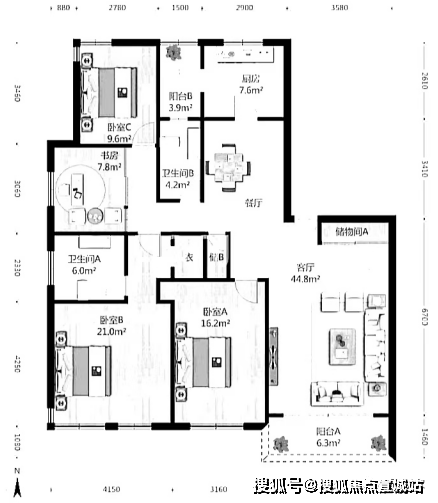
This screenshot has width=438, height=503. Find the location of `couches`. couches is located at coordinates (378, 346), (339, 393).